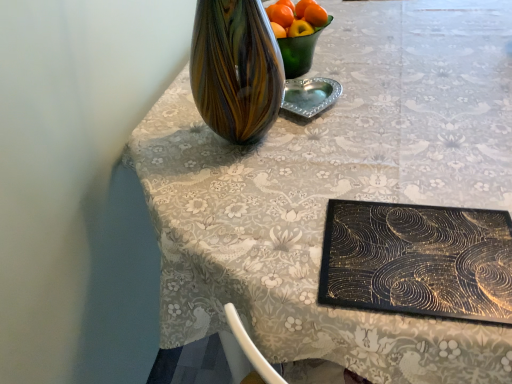
Question: Is orange matte at upper center taller or shorter than silver metallic heart-shaped tray at center?

Choices:
 (A) tall
 (B) short

Answer: (A)

Question: From a real-world perspective, relative to silver metallic heart-shaped tray at center, is orange matte at upper center vertically above or below?

Choices:
 (A) above
 (B) below

Answer: (A)

Question: Considering the positions of orange matte at upper center and silver metallic heart-shaped tray at center in the image, is orange matte at upper center wider or thinner than silver metallic heart-shaped tray at center?

Choices:
 (A) wide
 (B) thin

Answer: (B)

Question: Is point (295, 81) closer or farther from the camera than point (266, 11)?

Choices:
 (A) farther
 (B) closer

Answer: (A)

Question: Is silver metallic heart-shaped tray at center in front of or behind orange matte at upper center in the image?

Choices:
 (A) behind
 (B) front

Answer: (B)

Question: From the image's perspective, is silver metallic heart-shaped tray at center located above or below orange matte at upper center?

Choices:
 (A) below
 (B) above

Answer: (A)

Question: Looking at the image, does silver metallic heart-shaped tray at center seem bigger or smaller compared to orange matte at upper center?

Choices:
 (A) big
 (B) small

Answer: (A)